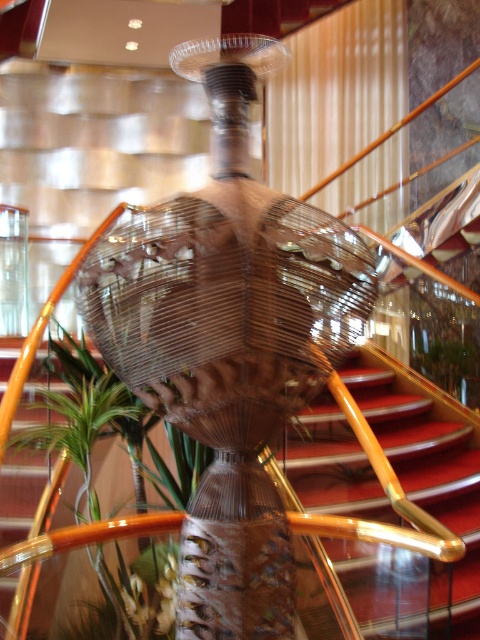
You are standing in the grand lobby and notice two points marked on the floor. The first point is labeled as point (391, 362), and the second is point (178, 429). If you were to walk from the sculpture towards the entrance, which point would you step on first?

Point (178, 429) would be stepped on first because point (391, 362) is behind it. Since you are moving from the sculpture towards the entrance, the closer point in front would be encountered first.

You are a maintenance worker needing to clean the red carpeted stairs at center and the shiny red carpet at center. The cleaning equipment you have can only reach objects within 4 inches. Can you clean both without moving the equipment?

The red carpeted stairs at center is 3.93 inches away from shiny red carpet at center, so yes, the equipment can reach both since the distance is within the 4 inches limit.